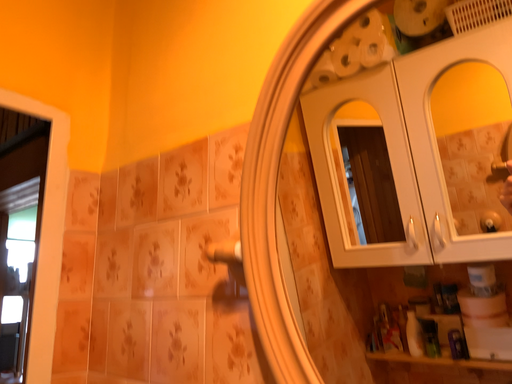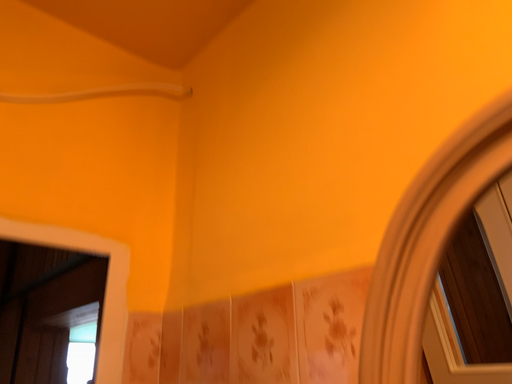
Question: How did the camera likely rotate when shooting the video?

Choices:
 (A) rotated upward
 (B) rotated downward

Answer: (A)